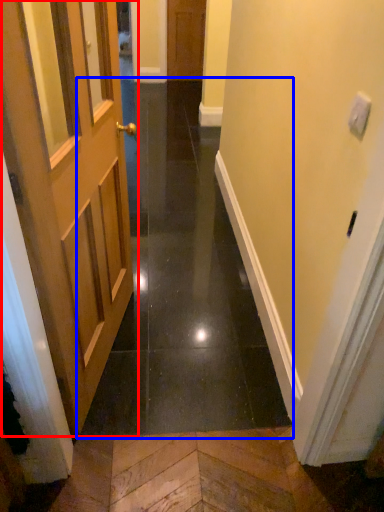
Question: Which object is further to the camera taking this photo, door (highlighted by a red box) or path (highlighted by a blue box)?

Choices:
 (A) door
 (B) path

Answer: (B)